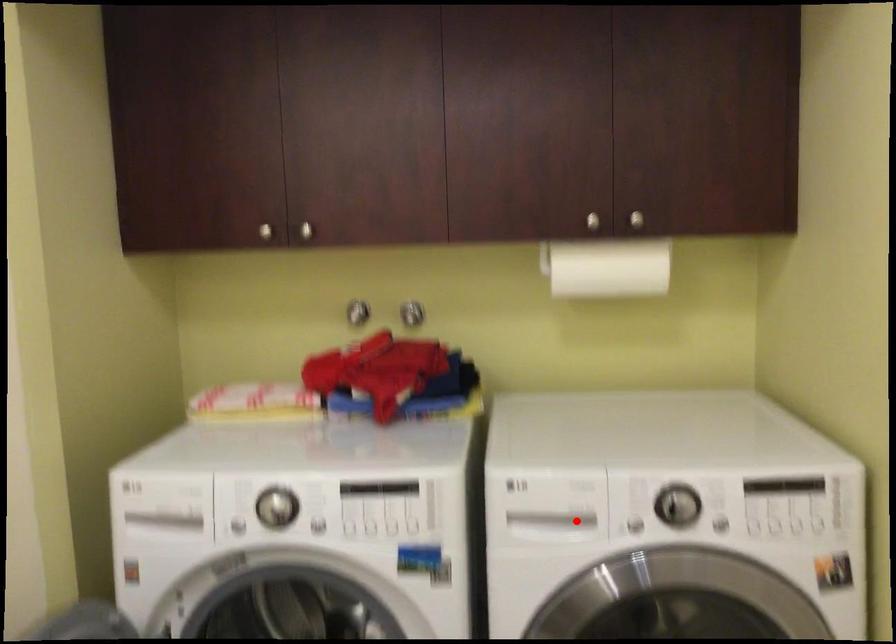
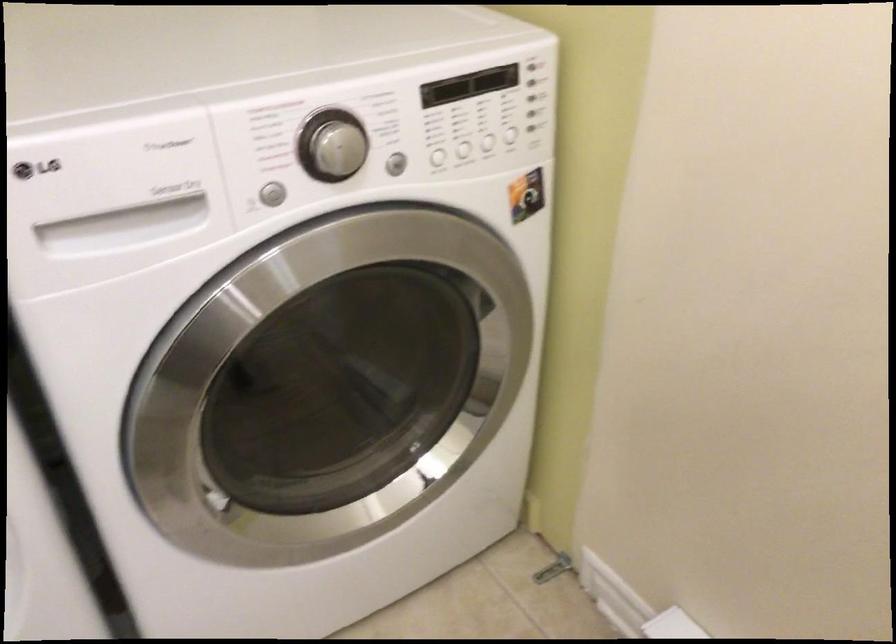
Question: I am providing you with two images of the same scene from different viewpoints. Image1 has a red point marked. In image2, the corresponding 3D location appears at what relative position? Reply with the corresponding letter.

Choices:
 (A) Closer
 (B) Farther

Answer: (A)